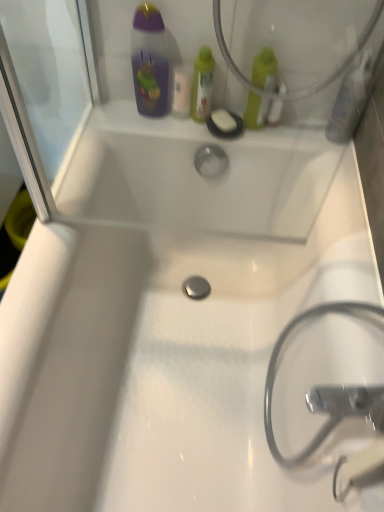
Locate an element on the screen. free location to the left of white matte soap at upper center is located at coordinates (168, 121).